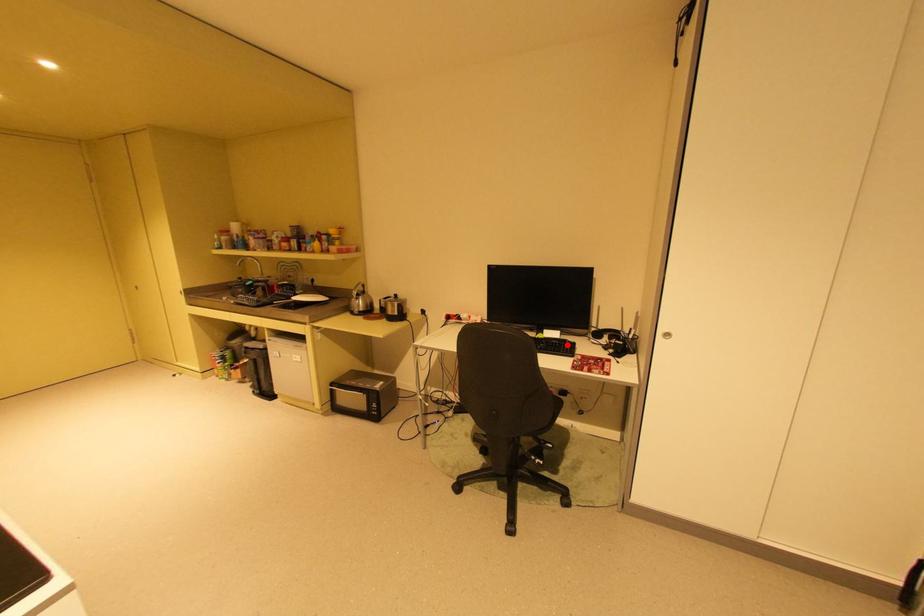
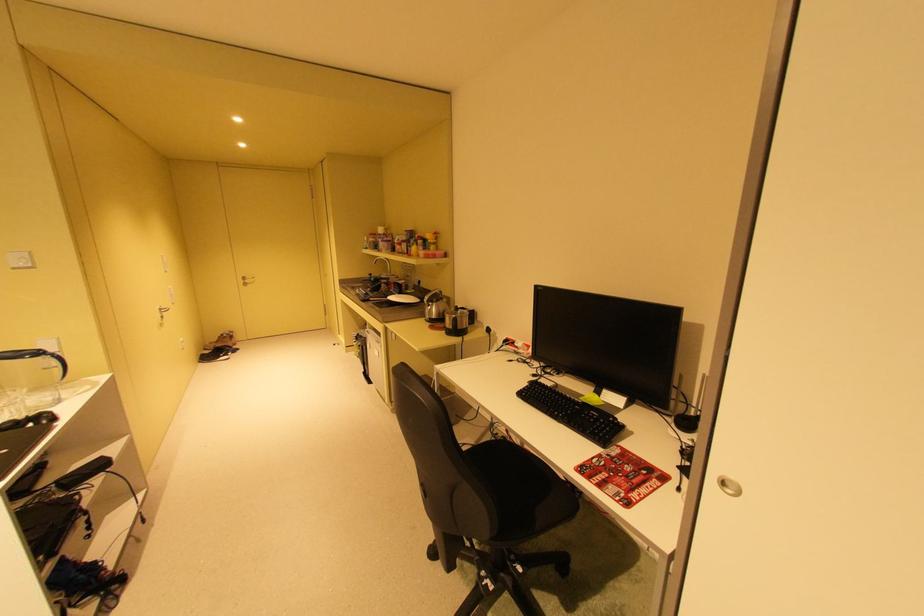
Where in the second image is the point corresponding to the highlighted location from the first image?

(604, 419)